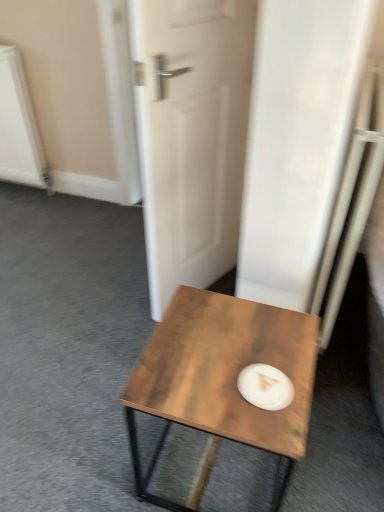
What is the approximate height of white matte door at center?

white matte door at center is 3.47 feet tall.

Image resolution: width=384 pixels, height=512 pixels. What do you see at coordinates (265, 387) in the screenshot? I see `white matte paper plate at center` at bounding box center [265, 387].

What is the approximate width of wooden coffee table at center?

wooden coffee table at center is 15.00 inches in width.

Where is `white matte door at center`? This screenshot has height=512, width=384. white matte door at center is located at coordinates (191, 135).

You are a GUI agent. You are given a task and a screenshot of the screen. Output one action in this format:
    pyautogui.click(x=<x>, y=<y>)
    Task: Click on the coffee table in front of the white matte door at center
    This screenshot has height=512, width=384.
    Given the screenshot: What is the action you would take?
    pyautogui.click(x=222, y=382)

Can you confirm if white matte door at center is wider than wooden coffee table at center?

In fact, white matte door at center might be narrower than wooden coffee table at center.

Between white matte door at center and wooden coffee table at center, which one appears on the left side from the viewer's perspective?

Positioned to the left is white matte door at center.

At what (x,y) coordinates should I click in order to perform the action: click on coffee table located in front of the white matte door at center. Please return your answer as a coordinate pair (x, y). The width and height of the screenshot is (384, 512). Looking at the image, I should click on (222, 382).

What's the angular difference between wooden coffee table at center and white matte door at center's facing directions?

There is a 114-degree angle between the facing directions of wooden coffee table at center and white matte door at center.

Does wooden coffee table at center contain white matte door at center?

No, wooden coffee table at center does not contain white matte door at center.

Is white matte door at center a part of white matte paper plate at center?

Definitely not — white matte door at center is not inside white matte paper plate at center.

Considering the relative sizes of white matte paper plate at center and white matte door at center in the image provided, is white matte paper plate at center bigger than white matte door at center?

Incorrect, white matte paper plate at center is not larger than white matte door at center.

Is white matte paper plate at center taller or shorter than white matte door at center?

white matte paper plate at center is shorter than white matte door at center.

Considering the sizes of objects white matte paper plate at center and wooden coffee table at center in the image provided, who is smaller, white matte paper plate at center or wooden coffee table at center?

white matte paper plate at center is smaller.

Is white matte paper plate at center wider than wooden coffee table at center?

In fact, white matte paper plate at center might be narrower than wooden coffee table at center.

Does white matte paper plate at center have a lesser height compared to wooden coffee table at center?

Yes.

Is wooden coffee table at center oriented away from white matte paper plate at center?

wooden coffee table at center is not turned away from white matte paper plate at center.

Considering the sizes of wooden coffee table at center and white matte paper plate at center in the image, is wooden coffee table at center wider or thinner than white matte paper plate at center?

Clearly, wooden coffee table at center has more width compared to white matte paper plate at center.

Can you confirm if wooden coffee table at center is smaller than white matte paper plate at center?

Actually, wooden coffee table at center might be larger than white matte paper plate at center.

Considering the sizes of white matte door at center and white matte paper plate at center in the image, is white matte door at center taller or shorter than white matte paper plate at center?

Clearly, white matte door at center is taller compared to white matte paper plate at center.

From the picture: Is the depth of white matte door at center less than that of white matte paper plate at center?

No, it is behind white matte paper plate at center.

From the image's perspective, which is below, white matte door at center or white matte paper plate at center?

white matte paper plate at center appears lower in the image.

Which is more to the left, white matte door at center or white matte paper plate at center?

white matte door at center is more to the left.

The image size is (384, 512). I want to click on coffee table in front of the white matte door at center, so click(x=222, y=382).

Where is `door behind the wooden coffee table at center`? This screenshot has height=512, width=384. door behind the wooden coffee table at center is located at coordinates (191, 135).

Based on their spatial positions, is white matte paper plate at center or wooden coffee table at center further from white matte door at center?

The object further to white matte door at center is white matte paper plate at center.

When comparing their distances from wooden coffee table at center, does white matte door at center or white matte paper plate at center seem closer?

Based on the image, white matte paper plate at center appears to be nearer to wooden coffee table at center.

Looking at the image, which one is located closer to white matte paper plate at center, white matte door at center or wooden coffee table at center?

wooden coffee table at center.

Which object lies nearer to the anchor point white matte door at center, wooden coffee table at center or white matte paper plate at center?

wooden coffee table at center.

Looking at the image, which one is located further to white matte paper plate at center, wooden coffee table at center or white matte door at center?

Among the two, white matte door at center is located further to white matte paper plate at center.

Looking at the image, which one is located further to wooden coffee table at center, white matte paper plate at center or white matte door at center?

Among the two, white matte door at center is located further to wooden coffee table at center.

Identify the location of paper plate between white matte door at center and wooden coffee table at center vertically. (265, 387).